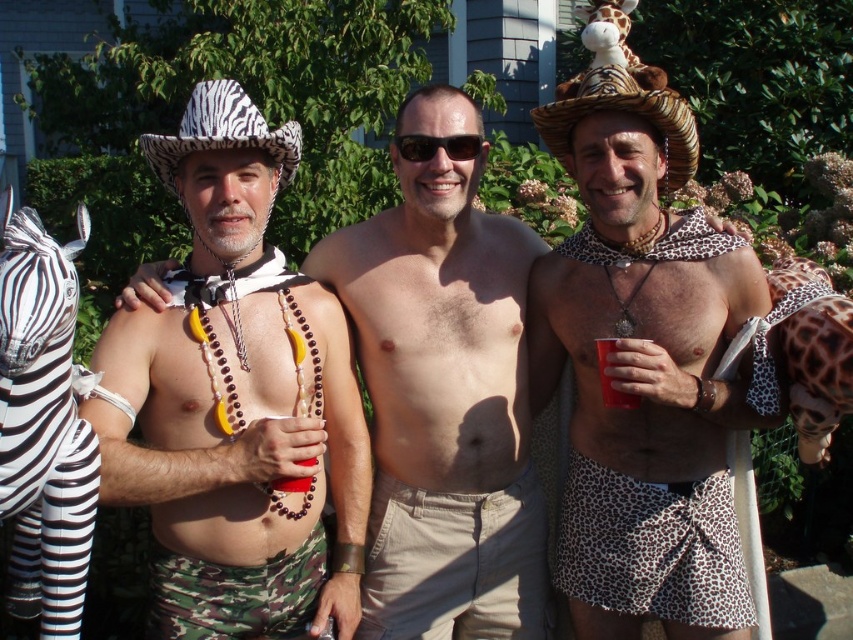
Does point (169, 316) come in front of point (207, 577)?

That is False.

Can you confirm if camouflage shorts at center is positioned above camouflage fabric shorts at center?

Yes, camouflage shorts at center is above camouflage fabric shorts at center.

Describe the element at coordinates (236, 401) in the screenshot. Image resolution: width=853 pixels, height=640 pixels. I see `camouflage shorts at center` at that location.

Locate an element on the screen. This screenshot has height=640, width=853. camouflage shorts at center is located at coordinates (236, 401).

Does leopard print shorts at center appear on the right side of red plastic cup at center?

→ Yes, leopard print shorts at center is to the right of red plastic cup at center.

Based on the photo, is leopard print shorts at center shorter than red plastic cup at center?

In fact, leopard print shorts at center may be taller than red plastic cup at center.

Is point (680, 577) farther from camera compared to point (618, 396)?

Yes, it is behind point (618, 396).

Where is `leopard print shorts at center`? This screenshot has height=640, width=853. leopard print shorts at center is located at coordinates (642, 365).

Is point (611, 484) in front of point (310, 572)?

No, it is not.

Is point (636, 506) positioned behind point (170, 582)?

Yes.

The image size is (853, 640). I want to click on leopard print fabric skirt at center, so click(x=653, y=547).

Locate an element on the screen. This screenshot has width=853, height=640. leopard print fabric skirt at center is located at coordinates (653, 547).